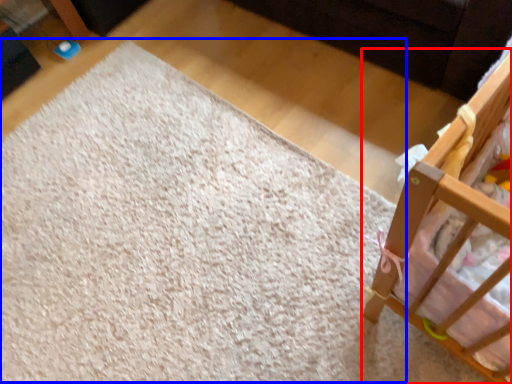
Question: Which point is closer to the camera, infant bed (highlighted by a red box) or mat (highlighted by a blue box)?

Choices:
 (A) infant bed
 (B) mat

Answer: (A)